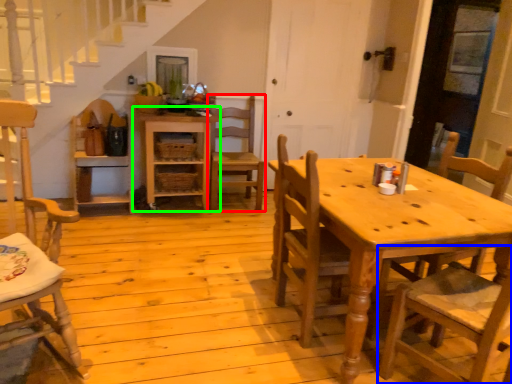
Question: Which object is positioned farthest from chair (highlighted by a red box)? Select from chair (highlighted by a blue box) and shelf (highlighted by a green box).

Choices:
 (A) chair
 (B) shelf

Answer: (A)